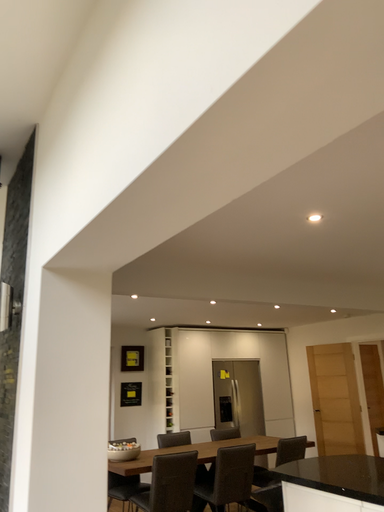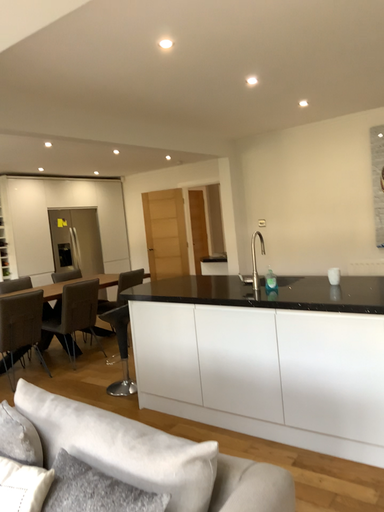
Question: How did the camera likely rotate when shooting the video?

Choices:
 (A) rotated right
 (B) rotated left

Answer: (A)